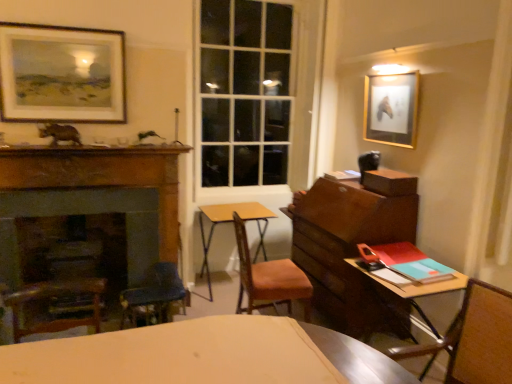
The image size is (512, 384). Identify the location of free point above wooden fireplace at left (from a real-world perspective). (78, 158).